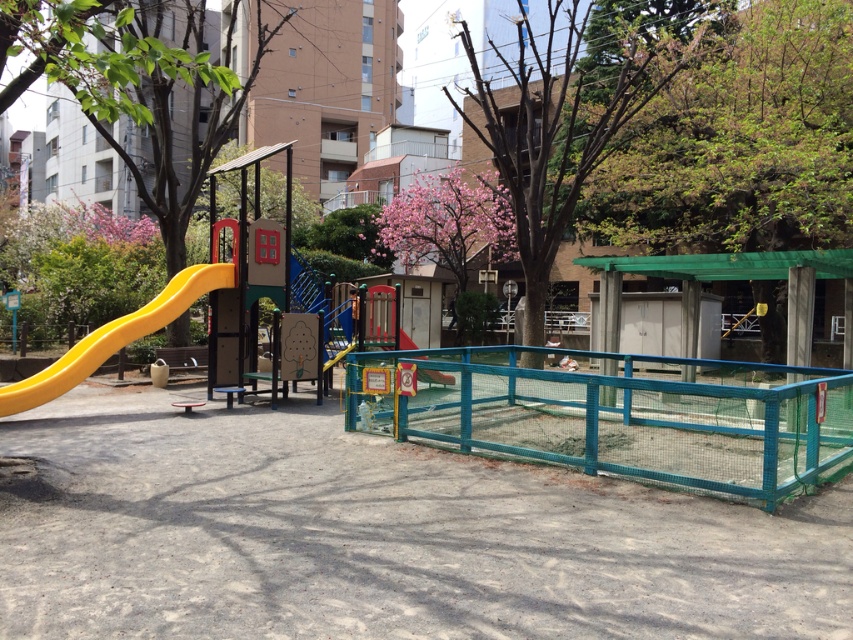
Between green leafy tree at upper right and green leafy tree at left, which one has less height?

Standing shorter between the two is green leafy tree at upper right.

Where is `green leafy tree at upper right`? green leafy tree at upper right is located at coordinates (741, 141).

Can you confirm if bare wood tree at center is thinner than yellow matte slide at center?

No, bare wood tree at center is not thinner than yellow matte slide at center.

Where is `bare wood tree at center`? The image size is (853, 640). bare wood tree at center is located at coordinates (576, 109).

Is point (544, 230) closer to camera compared to point (405, 340)?

No, (544, 230) is behind (405, 340).

At what (x,y) coordinates should I click in order to perform the action: click on bare wood tree at center. Please return your answer as a coordinate pair (x, y). This screenshot has height=640, width=853. Looking at the image, I should click on (576, 109).

Can you confirm if green leafy tree at upper right is positioned to the left of yellow matte slide at left?

No, green leafy tree at upper right is not to the left of yellow matte slide at left.

Where is `green leafy tree at upper right`? green leafy tree at upper right is located at coordinates (741, 141).